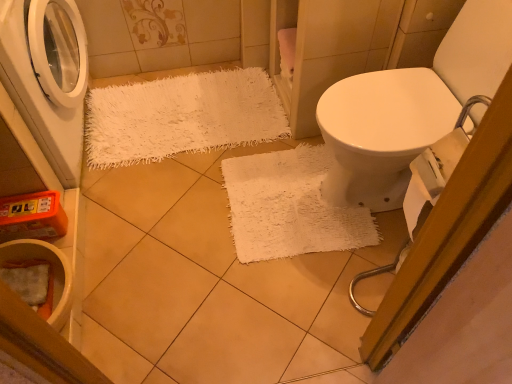
Locate an element on the screen. This screenshot has width=512, height=384. vacant space in white shaggy rug at upper left (from a real-world perspective) is located at coordinates (186, 115).